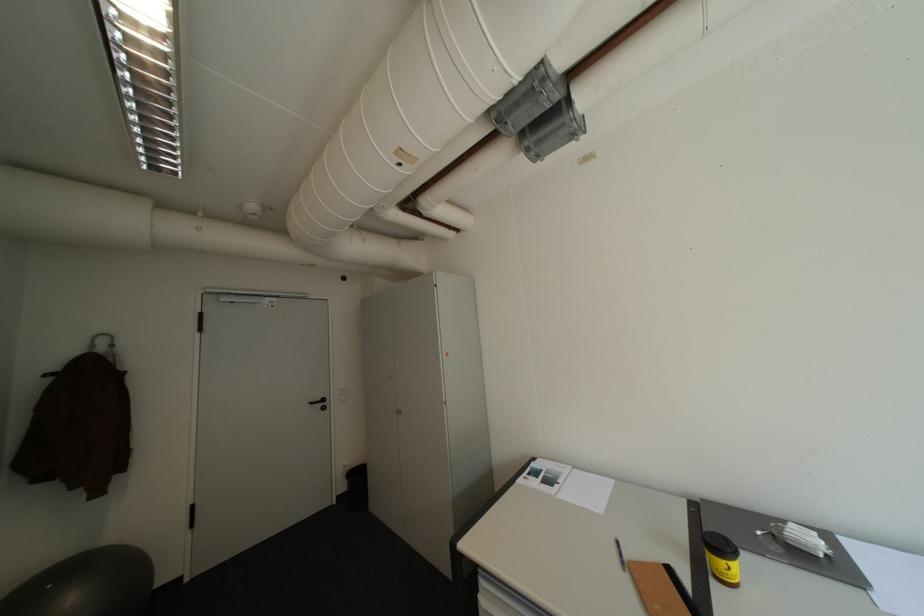
Where would you lift the yellow and black can? Please return your answer as a coordinate pair (x, y).

(722, 557)